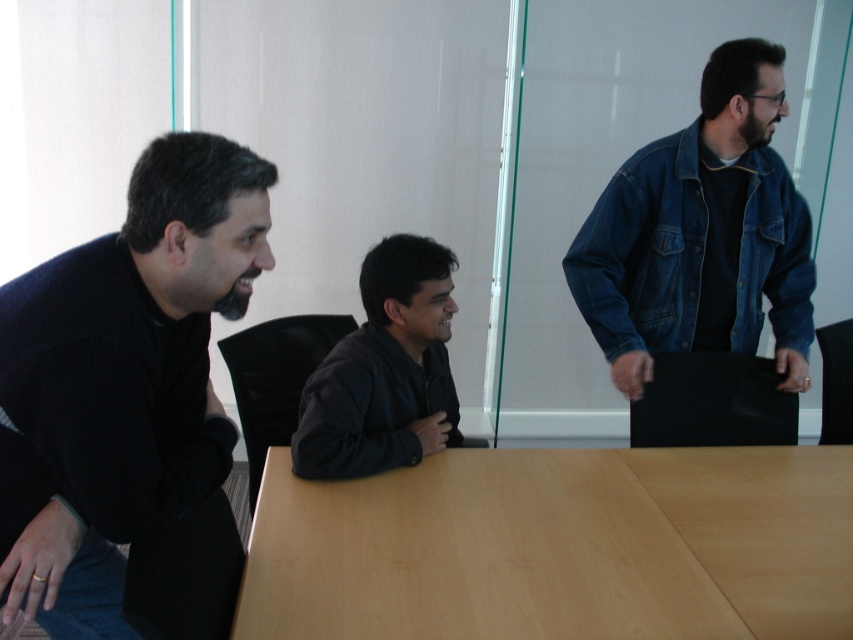
You are standing at the center of the conference table and want to pick up the denim jacket at right. In which direction should you move to reach it?

The denim jacket at right is located at point 0.366 on the x and 0.824 on the y. Since you are at the center, you should move towards the right and slightly forward to reach it.

You are standing in the room and want to hand a document to the person wearing the black leather jacket at center. Which direction should you walk to approach them from the dark blue sweater at left?

You should walk to the right from the dark blue sweater at left to approach the black leather jacket at center since the dark blue sweater at left is positioned on the left side of the black leather jacket at center.